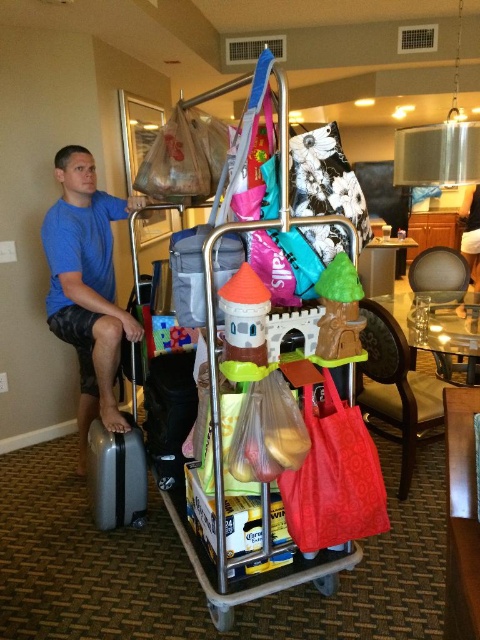
Question: Can you confirm if blue cotton shirt at left is positioned above black fabric suitcase at lower left?

Choices:
 (A) no
 (B) yes

Answer: (B)

Question: Which point is farther to the camera?

Choices:
 (A) plastic shopping cart at center
 (B) silver metallic suitcase at lower left
 (C) matte plastic suitcase at center

Answer: (B)

Question: Can you confirm if plastic shopping cart at center is positioned below matte plastic suitcase at center?

Choices:
 (A) yes
 (B) no

Answer: (A)

Question: Which object is farther from the camera taking this photo?

Choices:
 (A) matte plastic suitcase at center
 (B) silver metallic suitcase at lower left
 (C) black fabric suitcase at lower left

Answer: (B)

Question: Which object is the farthest from the plastic shopping cart at center?

Choices:
 (A) matte plastic suitcase at center
 (B) blue cotton shirt at left
 (C) black fabric suitcase at lower left
 (D) silver metallic suitcase at lower left

Answer: (B)

Question: Does black fabric suitcase at lower left have a greater width compared to matte plastic suitcase at center?

Choices:
 (A) no
 (B) yes

Answer: (B)